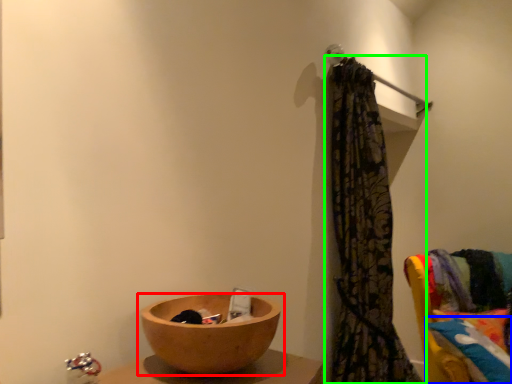
Question: Estimate the real-world distances between objects in this image. Which object is closer to tableware (highlighted by a red box), pillow (highlighted by a blue box) or curtain (highlighted by a green box)?

Choices:
 (A) pillow
 (B) curtain

Answer: (B)